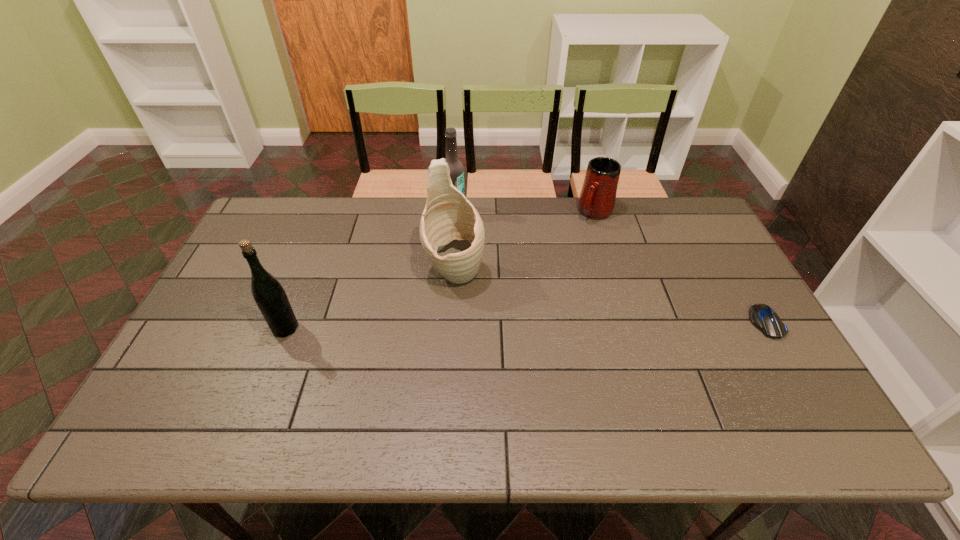
Image resolution: width=960 pixels, height=540 pixels. Identify the location of free space between the right beer bottle and the fourth tallest object. (525, 211).

I want to click on vacant region between the computer mouse and the nearer beer bottle, so click(x=525, y=325).

Where is `free area in between the fourth object from left to right and the shortest object`? This screenshot has width=960, height=540. free area in between the fourth object from left to right and the shortest object is located at coordinates (681, 267).

This screenshot has height=540, width=960. I want to click on free point between the nearer beer bottle and the farther beer bottle, so pyautogui.click(x=370, y=269).

Locate an element on the screen. unoccupied area between the computer mouse and the fourth tallest object is located at coordinates (681, 267).

Identify the location of unoccupied position between the rightmost object and the right beer bottle. (610, 266).

This screenshot has height=540, width=960. I want to click on free space between the tallest object and the leftmost object, so click(370, 300).

Locate which object is the third closest to the computer mouse. Please provide its 2D coordinates. Your answer should be formatted as a tuple, i.e. [(x, y)], where the tuple contains the x and y coordinates of a point satisfying the conditions above.

[(456, 168)]

At what (x,y) coordinates should I click in order to perform the action: click on object that stands as the closest to the computer mouse. Please return your answer as a coordinate pair (x, y). Looking at the image, I should click on (597, 199).

Find the location of a particular element. free spot that satisfies the following two spatial constraints: 1. on the back side of the tallest object; 2. on the left side of the fourth object from left to right is located at coordinates (458, 213).